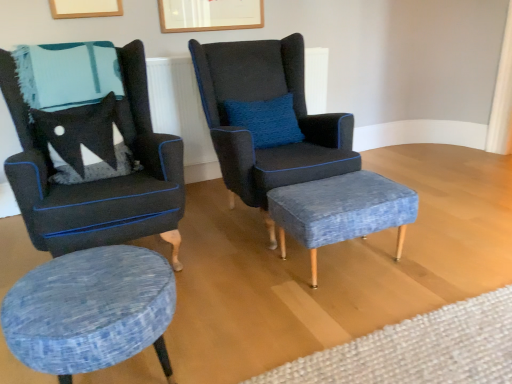
This screenshot has height=384, width=512. Find the location of `vacant space behind white textured rug at lower right, marked as the 1th plain in a back-to-front arrangement`. vacant space behind white textured rug at lower right, marked as the 1th plain in a back-to-front arrangement is located at coordinates (398, 274).